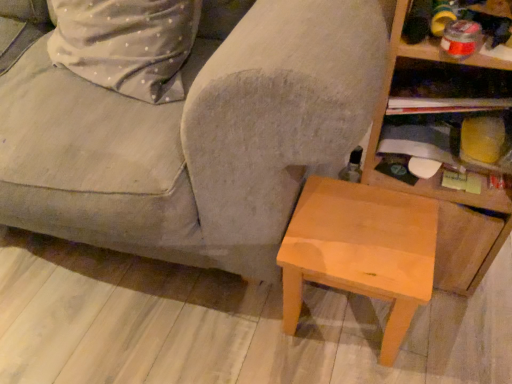
Question: Is gray fabric couch at center spatially inside wooden shelf at upper right, marked as the 2th shelf in a bottom-to-top arrangement, or outside of it?

Choices:
 (A) inside
 (B) outside

Answer: (B)

Question: Relative to wooden shelf at upper right, marked as the 2th shelf in a bottom-to-top arrangement, is gray fabric couch at center in front or behind?

Choices:
 (A) front
 (B) behind

Answer: (A)

Question: Based on their relative distances, which object is nearer to the wooden shelf at upper right, the 1th shelf positioned from the top?

Choices:
 (A) light brown wood stool at lower right
 (B) wooden at right, positioned as the second shelf in top-to-bottom order
 (C) gray fabric couch at center

Answer: (B)

Question: Based on their relative distances, which object is farther from the wooden shelf at upper right, marked as the 2th shelf in a bottom-to-top arrangement?

Choices:
 (A) light brown wood stool at lower right
 (B) wooden at right, positioned as the second shelf in top-to-bottom order
 (C) gray fabric couch at center

Answer: (C)